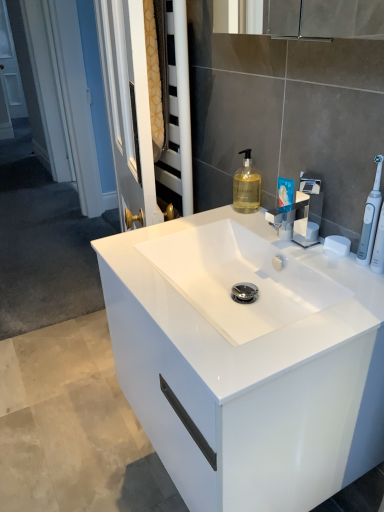
The image size is (384, 512). In order to click on vacant space to the left of white matte soap at upper right in this screenshot , I will do (x=292, y=249).